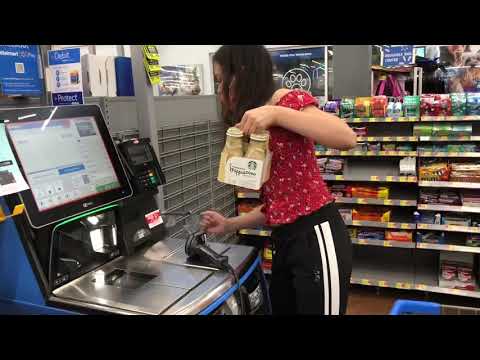
Find the location of `scanner`. scanner is located at coordinates (195, 244).